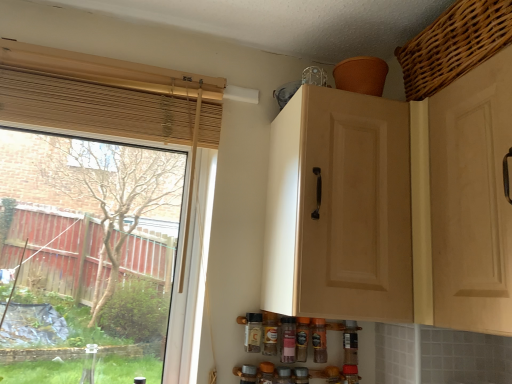
Question: Does woven brown basket at upper right have a lesser width compared to transparent glass window at left?

Choices:
 (A) no
 (B) yes

Answer: (A)

Question: Does woven brown basket at upper right contain transparent glass window at left?

Choices:
 (A) yes
 (B) no

Answer: (B)

Question: Is woven brown basket at upper right located outside transparent glass window at left?

Choices:
 (A) yes
 (B) no

Answer: (A)

Question: From the image's perspective, is woven brown basket at upper right below transparent glass window at left?

Choices:
 (A) no
 (B) yes

Answer: (A)

Question: Is woven brown basket at upper right smaller than transparent glass window at left?

Choices:
 (A) yes
 (B) no

Answer: (A)

Question: Is point (465, 54) positioned closer to the camera than point (274, 322)?

Choices:
 (A) closer
 (B) farther

Answer: (A)

Question: Is woven brown basket at upper right taller or shorter than translucent plastic spice bottle at center, which is counted as the fourth bottle, starting from the right?

Choices:
 (A) tall
 (B) short

Answer: (A)

Question: From a real-world perspective, is woven brown basket at upper right above or below translucent plastic spice bottle at center, which is the 2th bottle from left to right?

Choices:
 (A) above
 (B) below

Answer: (A)

Question: Relative to translucent plastic spice bottle at center, which is counted as the fourth bottle, starting from the right, is woven brown basket at upper right in front or behind?

Choices:
 (A) behind
 (B) front

Answer: (B)

Question: In terms of size, does matte wood cabinet at upper center appear bigger or smaller than matte glass spice bottle at lower center, the 5th bottle in the right-to-left sequence?

Choices:
 (A) big
 (B) small

Answer: (A)

Question: Is matte wood cabinet at upper center to the left or to the right of matte glass spice bottle at lower center, the 5th bottle in the right-to-left sequence, in the image?

Choices:
 (A) left
 (B) right

Answer: (B)

Question: Relative to matte glass spice bottle at lower center, placed as the first bottle when sorted from left to right, is matte wood cabinet at upper center in front or behind?

Choices:
 (A) front
 (B) behind

Answer: (A)

Question: Which is correct: matte wood cabinet at upper center is inside matte glass spice bottle at lower center, placed as the first bottle when sorted from left to right, or outside of it?

Choices:
 (A) outside
 (B) inside

Answer: (A)

Question: Considering their positions, is translucent plastic spice bottle at lower center, the 3th bottle when ordered from right to left, located in front of or behind matte wood cabinet at upper center?

Choices:
 (A) behind
 (B) front

Answer: (A)

Question: In terms of width, does translucent plastic spice bottle at lower center, the 3th bottle in the left-to-right sequence, look wider or thinner when compared to matte wood cabinet at upper center?

Choices:
 (A) thin
 (B) wide

Answer: (A)